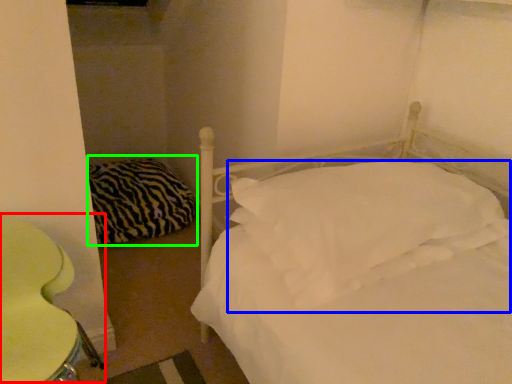
Question: Considering the real-world distances, which object is farthest from swivel chair (highlighted by a red box)? pillow (highlighted by a blue box) or pillow (highlighted by a green box)?

Choices:
 (A) pillow
 (B) pillow

Answer: (B)